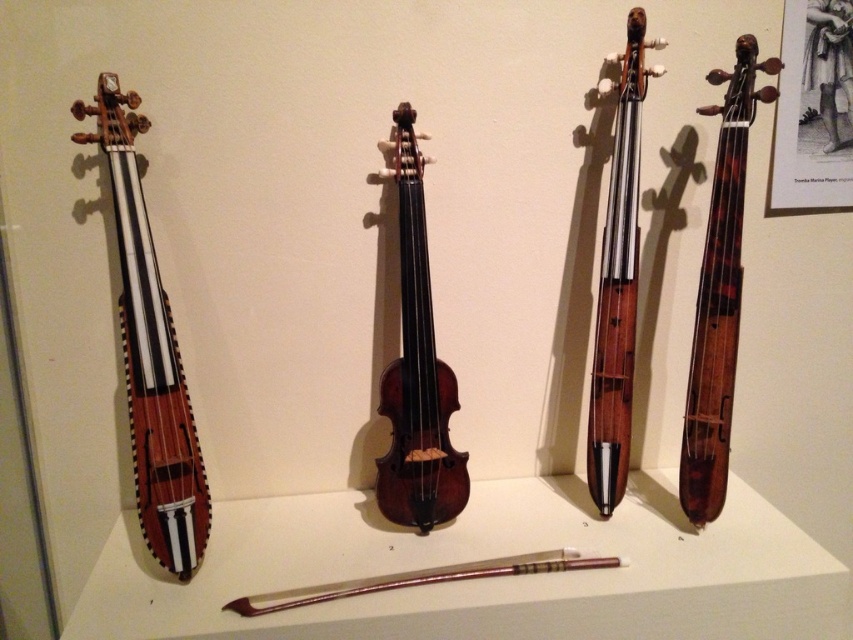
Question: Is shiny brown violin at center further to camera compared to wooden violin at right?

Choices:
 (A) no
 (B) yes

Answer: (B)

Question: Which object is positioned farthest from the wooden violin at center?

Choices:
 (A) shiny brown violin at center
 (B) wooden violin at right
 (C) wooden violin at left

Answer: (C)

Question: Which point is farther from the camera taking this photo?

Choices:
 (A) (167, 467)
 (B) (399, 248)
 (C) (637, 246)
 (D) (705, 266)

Answer: (B)

Question: Considering the relative positions of wooden violin at left and shiny brown violin at center in the image provided, where is wooden violin at left located with respect to shiny brown violin at center?

Choices:
 (A) below
 (B) above

Answer: (A)

Question: Which point is closer to the camera taking this photo?

Choices:
 (A) (164, 540)
 (B) (737, 296)
 (C) (437, 376)
 (D) (602, 497)

Answer: (A)

Question: Observing the image, what is the correct spatial positioning of wooden violin at left in reference to wooden violin at center?

Choices:
 (A) below
 (B) above

Answer: (A)